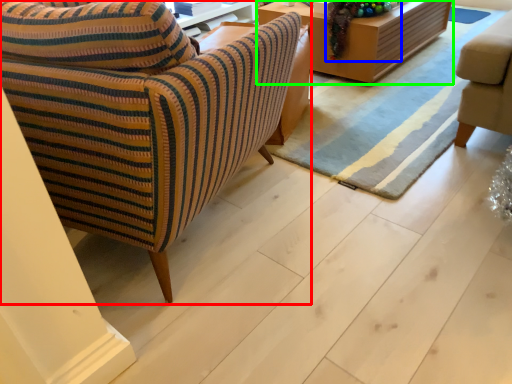
Question: Based on their relative distances, which object is farther from chair (highlighted by a red box)? Choose from christmas decoration (highlighted by a blue box) and table (highlighted by a green box).

Choices:
 (A) christmas decoration
 (B) table

Answer: (B)